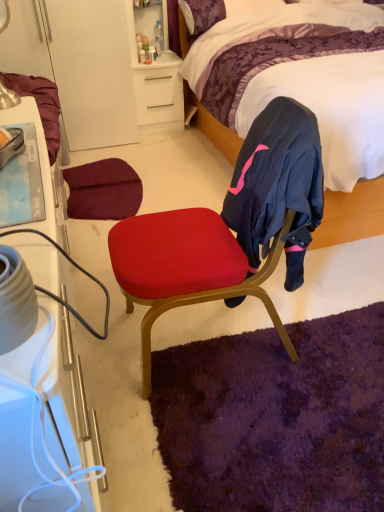
What is the approximate height of white plastic cabinet at left?

The height of white plastic cabinet at left is 79.41 centimeters.

Describe the element at coordinates (40, 165) in the screenshot. Image resolution: width=384 pixels, height=512 pixels. I see `white plastic cabinet at left` at that location.

This screenshot has width=384, height=512. What do you see at coordinates (275, 417) in the screenshot?
I see `purple shag rug at lower center` at bounding box center [275, 417].

This screenshot has width=384, height=512. I want to click on velvet purple bed at upper right, so click(351, 215).

Image resolution: width=384 pixels, height=512 pixels. Identify the location of matte black sneakers at upper left. (10, 144).

Does point (81, 444) come behind point (328, 197)?

No, it is not.

Which is more to the right, white plastic cabinet at left or velvet purple bed at upper right?

Positioned to the right is velvet purple bed at upper right.

Considering the relative sizes of white plastic cabinet at left and velvet purple bed at upper right in the image provided, is white plastic cabinet at left shorter than velvet purple bed at upper right?

Correct, white plastic cabinet at left is not as tall as velvet purple bed at upper right.

From a real-world perspective, is white plastic cabinet at left above or below velvet purple bed at upper right?

From a real-world perspective, white plastic cabinet at left is physically below velvet purple bed at upper right.

How much distance is there between brushed metal table lamp at upper left and white matte desk at upper center?

brushed metal table lamp at upper left and white matte desk at upper center are 5.98 feet apart.

Can you confirm if brushed metal table lamp at upper left is positioned to the left of white matte desk at upper center?

Correct, you'll find brushed metal table lamp at upper left to the left of white matte desk at upper center.

From the image's perspective, would you say brushed metal table lamp at upper left is positioned over white matte desk at upper center?

Actually, brushed metal table lamp at upper left appears below white matte desk at upper center in the image.

From a real-world perspective, is brushed metal table lamp at upper left positioned under white matte desk at upper center based on gravity?

No, from a real-world perspective, brushed metal table lamp at upper left is not under white matte desk at upper center.

From a real-world perspective, is matte black sneakers at upper left on top of velvet purple bed at upper right?

Yes, from a real-world perspective, matte black sneakers at upper left is above velvet purple bed at upper right.

Is matte black sneakers at upper left closer to the viewer compared to velvet purple bed at upper right?

Yes, it is in front of velvet purple bed at upper right.

Does matte black sneakers at upper left have a lesser height compared to velvet purple bed at upper right?

Indeed, matte black sneakers at upper left has a lesser height compared to velvet purple bed at upper right.

Consider the image. Which is nearer, (22, 130) or (365, 218)?

The point (22, 130) is closer.

Considering the positions of objects velvet purple bed at upper right and matte black sneakers at upper left in the image provided, who is more to the right, velvet purple bed at upper right or matte black sneakers at upper left?

Positioned to the right is velvet purple bed at upper right.

What's the angular difference between velvet purple bed at upper right and matte black sneakers at upper left's facing directions?

There is a 68.6-degree angle between the facing directions of velvet purple bed at upper right and matte black sneakers at upper left.

From a real-world perspective, does velvet purple bed at upper right sit lower than matte black sneakers at upper left?

Yes, from a real-world perspective, velvet purple bed at upper right is under matte black sneakers at upper left.

Is point (341, 203) farther from viewer compared to point (17, 143)?

Yes, point (341, 203) is farther from viewer.

Is brushed metal table lamp at upper left facing towards purple shag rug at lower center?

No, brushed metal table lamp at upper left is not turned towards purple shag rug at lower center.

Is brushed metal table lamp at upper left positioned beyond the bounds of purple shag rug at lower center?

Yes, brushed metal table lamp at upper left is located beyond the bounds of purple shag rug at lower center.

Considering their positions, is brushed metal table lamp at upper left located in front of or behind purple shag rug at lower center?

Clearly, brushed metal table lamp at upper left is behind purple shag rug at lower center.

Can you tell me how much brushed metal table lamp at upper left and purple shag rug at lower center differ in facing direction?

They differ by 137 degrees in their facing directions.

In the scene shown: Does matte black sneakers at upper left appear on the right side of white matte desk at upper center?

No, matte black sneakers at upper left is not to the right of white matte desk at upper center.

Is the position of matte black sneakers at upper left more distant than that of white matte desk at upper center?

No, the depth of matte black sneakers at upper left is less than that of white matte desk at upper center.

Locate an element on the screen. This screenshot has width=384, height=512. sneakers located below the white matte desk at upper center (from the image's perspective) is located at coordinates (10, 144).

How many degrees apart are the facing directions of matte black sneakers at upper left and white matte desk at upper center?

They differ by 66.8 degrees in their facing directions.

Is the depth of white plastic cabinet at left greater than that of purple shag rug at lower center?

No, white plastic cabinet at left is closer to the camera.

Based on their sizes in the image, would you say white plastic cabinet at left is bigger or smaller than purple shag rug at lower center?

In the image, white plastic cabinet at left appears to be larger than purple shag rug at lower center.

Is white plastic cabinet at left inside or outside of purple shag rug at lower center?

white plastic cabinet at left cannot be found inside purple shag rug at lower center.

Where is `bed located behind the white plastic cabinet at left`? The width and height of the screenshot is (384, 512). bed located behind the white plastic cabinet at left is located at coordinates (351, 215).

Locate an element on the screen. The height and width of the screenshot is (512, 384). table lamp lying in front of the white matte desk at upper center is located at coordinates (8, 98).

Estimate the real-world distances between objects in this image. Which object is closer to velvet red chair at center, white matte desk at upper center or purple shag rug at lower center?

The object closer to velvet red chair at center is purple shag rug at lower center.

Based on the photo, based on their spatial positions, is white plastic cabinet at left or brushed metal table lamp at upper left further from white matte desk at upper center?

Based on the image, white plastic cabinet at left appears to be further to white matte desk at upper center.

Looking at the image, which one is located closer to velvet purple bed at upper right, white matte desk at upper center or white plastic cabinet at left?

white matte desk at upper center lies closer to velvet purple bed at upper right than the other object.

From the image, which object appears to be nearer to matte black sneakers at upper left, white matte desk at upper center or brushed metal table lamp at upper left?

Based on the image, brushed metal table lamp at upper left appears to be nearer to matte black sneakers at upper left.

Estimate the real-world distances between objects in this image. Which object is closer to white plastic cabinet at left, white matte desk at upper center or velvet purple bed at upper right?

velvet purple bed at upper right is closer to white plastic cabinet at left.

Estimate the real-world distances between objects in this image. Which object is closer to velvet red chair at center, white plastic cabinet at left or brushed metal table lamp at upper left?

The object closer to velvet red chair at center is white plastic cabinet at left.

Considering their positions, is matte black sneakers at upper left positioned closer to brushed metal table lamp at upper left than purple shag rug at lower center?

matte black sneakers at upper left is positioned closer to the anchor brushed metal table lamp at upper left.

Considering their positions, is brushed metal table lamp at upper left positioned further to white plastic cabinet at left than purple shag rug at lower center?

purple shag rug at lower center is positioned further to the anchor white plastic cabinet at left.

Where is `table lamp between velvet red chair at center and white matte desk at upper center from front to back`? This screenshot has height=512, width=384. table lamp between velvet red chair at center and white matte desk at upper center from front to back is located at coordinates (8, 98).

Find the location of a particular element. This screenshot has width=384, height=512. chair that lies between brushed metal table lamp at upper left and white plastic cabinet at left from top to bottom is located at coordinates (229, 229).

Image resolution: width=384 pixels, height=512 pixels. In order to click on chair between white plastic cabinet at left and white matte desk at upper center along the z-axis in this screenshot , I will do `click(229, 229)`.

In order to click on plain between velvet red chair at center and white matte desk at upper center in the front-back direction in this screenshot , I will do `click(275, 417)`.